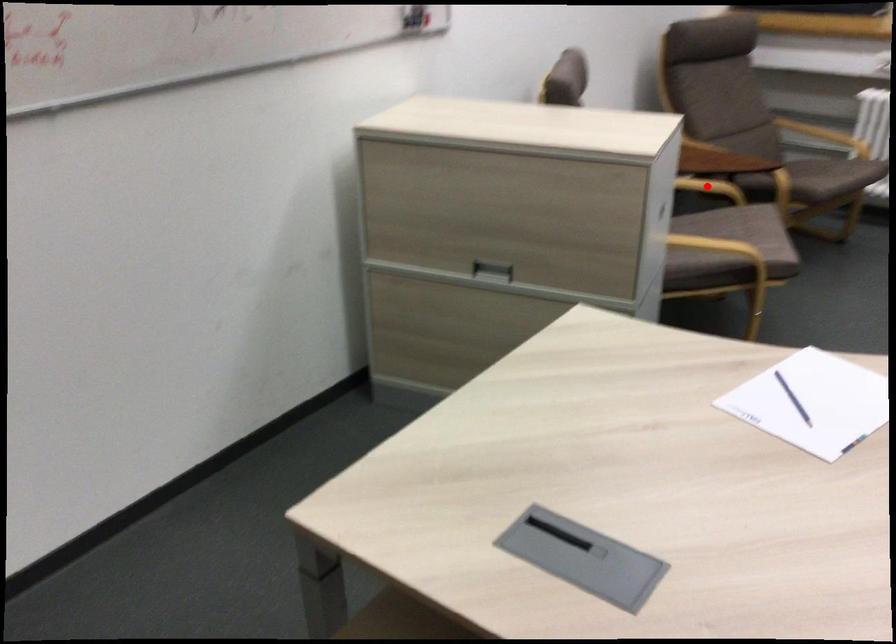
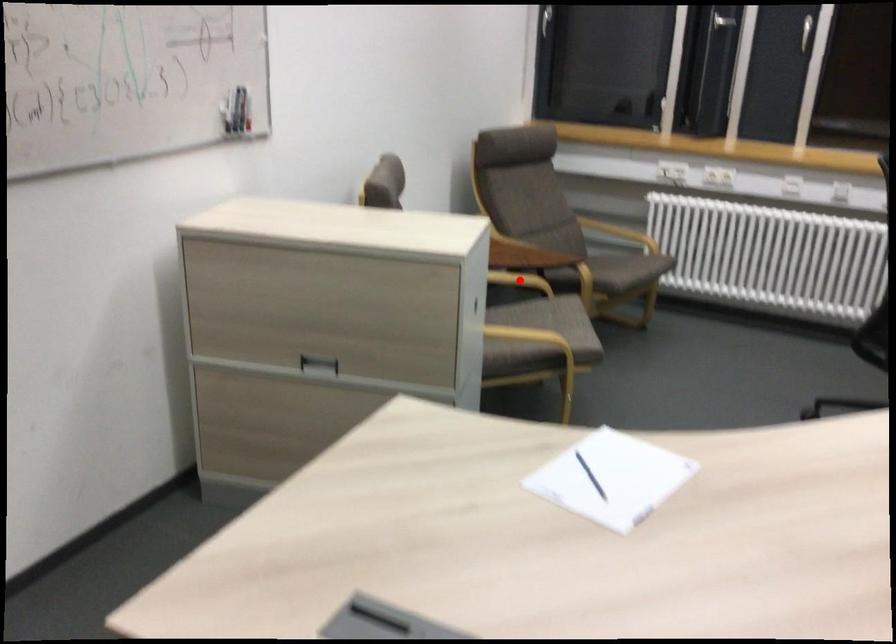
I am providing you with two images of the same scene from different viewpoints. A red point is marked on the first image and another point is marked on the second image. Is the marked point in image1 the same physical position as the marked point in image2?

Yes